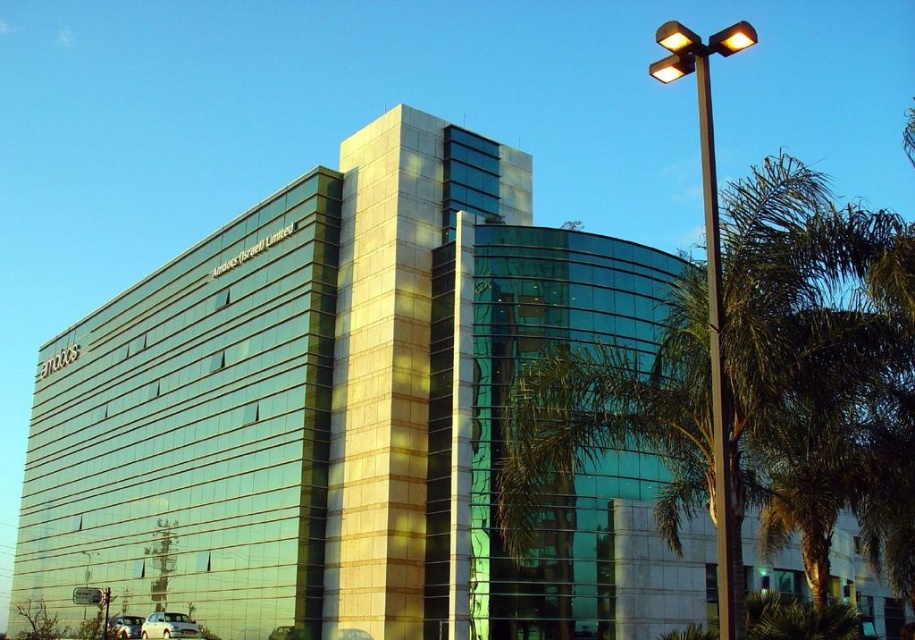
Question: Which point is closer to the camera taking this photo?

Choices:
 (A) (718, 422)
 (B) (693, 308)

Answer: (A)

Question: Does green leafy palm tree at right have a larger size compared to black metal pole at right?

Choices:
 (A) yes
 (B) no

Answer: (B)

Question: Which object is closer to the camera taking this photo?

Choices:
 (A) green leafy palm tree at right
 (B) black metal pole at right

Answer: (A)

Question: Which object is farther from the camera taking this photo?

Choices:
 (A) black metal pole at right
 (B) green leafy palm tree at right

Answer: (A)

Question: Is green leafy palm tree at right to the right of black metal pole at right from the viewer's perspective?

Choices:
 (A) no
 (B) yes

Answer: (B)

Question: Can you confirm if green leafy palm tree at right is bigger than black metal pole at right?

Choices:
 (A) yes
 (B) no

Answer: (B)